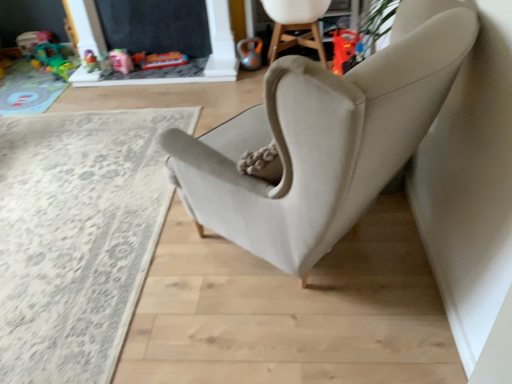
What do you see at coordinates (161, 60) in the screenshot?
I see `plastic toy car at upper center, positioned as the second toy in right-to-left order` at bounding box center [161, 60].

This screenshot has height=384, width=512. What do you see at coordinates (296, 25) in the screenshot? I see `suede beige armchair at upper center` at bounding box center [296, 25].

The image size is (512, 384). What do you see at coordinates (52, 59) in the screenshot?
I see `translucent plastic toy at upper left, which is the fourth toy from right to left` at bounding box center [52, 59].

This screenshot has width=512, height=384. I want to click on plastic toy car at upper center, positioned as the 4th toy in left-to-right order, so click(x=161, y=60).

From the image's perspective, does beige carpet at lower left appear lower than matte pink toy at upper left, positioned as the 3th toy in left-to-right order?

Yes, from the image's perspective, beige carpet at lower left is below matte pink toy at upper left, positioned as the 3th toy in left-to-right order.

Which is in front, point (39, 353) or point (115, 53)?

The point (39, 353) is in front.

Looking at this image, who is smaller, beige carpet at lower left or matte pink toy at upper left, positioned as the 3th toy in left-to-right order?

Smaller between the two is matte pink toy at upper left, positioned as the 3th toy in left-to-right order.

Who is bigger, translucent plastic toy at upper left, which is the 2th toy from left to right, or orange metallic kettlebell at upper center, which ranks as the first toy in right-to-left order?

With larger size is translucent plastic toy at upper left, which is the 2th toy from left to right.

From a real-world perspective, is translucent plastic toy at upper left, which is the 2th toy from left to right, located beneath orange metallic kettlebell at upper center, arranged as the 5th toy when viewed from the left?

Correct, in the physical world, translucent plastic toy at upper left, which is the 2th toy from left to right, is lower than orange metallic kettlebell at upper center, arranged as the 5th toy when viewed from the left.

From a real-world perspective, count 3rd toys downward from the orange metallic kettlebell at upper center, which ranks as the first toy in right-to-left order, and point to it. Please provide its 2D coordinates.

[(52, 59)]

Is translucent plastic toy at upper left, which is the fourth toy from right to left, wider than orange metallic kettlebell at upper center, arranged as the 5th toy when viewed from the left?

Yes.

Based on the photo, who is shorter, suede beige armchair at upper center or translucent plastic toy at upper left, which is the 2th toy from left to right?

With less height is translucent plastic toy at upper left, which is the 2th toy from left to right.

Considering the sizes of objects suede beige armchair at upper center and translucent plastic toy at upper left, which is the fourth toy from right to left, in the image provided, who is wider, suede beige armchair at upper center or translucent plastic toy at upper left, which is the fourth toy from right to left,?

With larger width is suede beige armchair at upper center.

Considering the relative sizes of suede beige armchair at upper center and translucent plastic toy at upper left, which is the 2th toy from left to right, in the image provided, is suede beige armchair at upper center bigger than translucent plastic toy at upper left, which is the 2th toy from left to right,?

Yes, suede beige armchair at upper center is bigger than translucent plastic toy at upper left, which is the 2th toy from left to right.

Is suede beige armchair at upper center facing towards translucent plastic toy at upper left, which is the fourth toy from right to left?

No.

Choose the correct answer: Is beige carpet at lower left inside suede beige armchair at upper center or outside it?

beige carpet at lower left cannot be found inside suede beige armchair at upper center.

From the image's perspective, would you say beige carpet at lower left is shown under suede beige armchair at upper center?

Yes, from the image's perspective, beige carpet at lower left is below suede beige armchair at upper center.

Are beige carpet at lower left and suede beige armchair at upper center located far from each other?

Yes, beige carpet at lower left and suede beige armchair at upper center are located far from each other.

The width and height of the screenshot is (512, 384). I want to click on toy that is the 4th object located above the beige carpet at lower left (from the image's perspective), so click(x=52, y=59).

Is beige carpet at lower left turned away from translucent plastic toy at upper left, which is the 2th toy from left to right?

beige carpet at lower left is not turned away from translucent plastic toy at upper left, which is the 2th toy from left to right.

From the image's perspective, is beige carpet at lower left positioned above or below translucent plastic toy at upper left, which is the 2th toy from left to right?

beige carpet at lower left is situated lower than translucent plastic toy at upper left, which is the 2th toy from left to right, in the image.

Considering their positions, is black chalkboard at upper center located in front of or behind orange metallic kettlebell at upper center, which ranks as the first toy in right-to-left order?

Visually, black chalkboard at upper center is located in front of orange metallic kettlebell at upper center, which ranks as the first toy in right-to-left order.

What's the angular difference between black chalkboard at upper center and orange metallic kettlebell at upper center, arranged as the 5th toy when viewed from the left,'s facing directions?

10.8 degrees.

Considering the relative sizes of black chalkboard at upper center and orange metallic kettlebell at upper center, arranged as the 5th toy when viewed from the left, in the image provided, is black chalkboard at upper center wider than orange metallic kettlebell at upper center, arranged as the 5th toy when viewed from the left,?

In fact, black chalkboard at upper center might be narrower than orange metallic kettlebell at upper center, arranged as the 5th toy when viewed from the left.

Based on their positions, is black chalkboard at upper center located to the left or right of orange metallic kettlebell at upper center, which ranks as the first toy in right-to-left order?

Clearly, black chalkboard at upper center is on the left of orange metallic kettlebell at upper center, which ranks as the first toy in right-to-left order, in the image.

Is suede beige armchair at upper center oriented away from matte pink toy at upper left, positioned as the 3th toy in left-to-right order?

No, suede beige armchair at upper center's orientation is not away from matte pink toy at upper left, positioned as the 3th toy in left-to-right order.

Is suede beige armchair at upper center shorter than matte pink toy at upper left, positioned as the 3th toy in left-to-right order?

In fact, suede beige armchair at upper center may be taller than matte pink toy at upper left, positioned as the 3th toy in left-to-right order.

From the image's perspective, is suede beige armchair at upper center under matte pink toy at upper left, positioned as the 3th toy in left-to-right order?

Answer: Incorrect, from the image's perspective, suede beige armchair at upper center is higher than matte pink toy at upper left, positioned as the 3th toy in left-to-right order.

Is suede beige armchair at upper center positioned far away from matte pink toy at upper left, arranged as the third toy when viewed from the right?

Yes, suede beige armchair at upper center and matte pink toy at upper left, arranged as the third toy when viewed from the right, are quite far apart.

Image resolution: width=512 pixels, height=384 pixels. In order to click on plain in front of the matte pink toy at upper left, arranged as the third toy when viewed from the right in this screenshot , I will do `click(77, 236)`.

What are the coordinates of `the 1st toy positioned below the translucent plastic toy at upper left, which is the 2th toy from left to right (from the image's perspective)` in the screenshot? It's located at (250, 53).

Estimate the real-world distances between objects in this image. Which object is closer to beige carpet at lower left, matte pink toy at upper left, positioned as the 3th toy in left-to-right order, or translucent plastic toy at upper left, which is the 2th toy from left to right?

Based on the image, matte pink toy at upper left, positioned as the 3th toy in left-to-right order, appears to be nearer to beige carpet at lower left.

Which object lies further to the anchor point plastic toy car at upper center, positioned as the 4th toy in left-to-right order, plastic pink toy at upper left, the first toy viewed from the left, or orange metallic kettlebell at upper center, which ranks as the first toy in right-to-left order?

plastic pink toy at upper left, the first toy viewed from the left.

Looking at the image, which one is located closer to translucent plastic toy at upper left, which is the fourth toy from right to left, beige carpet at lower left or plastic toy car at upper center, positioned as the 4th toy in left-to-right order?

plastic toy car at upper center, positioned as the 4th toy in left-to-right order, is positioned closer to the anchor translucent plastic toy at upper left, which is the fourth toy from right to left.

Consider the image. From the image, which object appears to be farther from plastic pink toy at upper left, placed as the 5th toy when sorted from right to left, beige carpet at lower left or plastic toy car at upper center, positioned as the second toy in right-to-left order?

Among the two, beige carpet at lower left is located further to plastic pink toy at upper left, placed as the 5th toy when sorted from right to left.

Estimate the real-world distances between objects in this image. Which object is further from translucent plastic toy at upper left, which is the fourth toy from right to left, plastic pink toy at upper left, placed as the 5th toy when sorted from right to left, or beige carpet at lower left?

beige carpet at lower left.

Which object lies further to the anchor point black chalkboard at upper center, plastic toy car at upper center, positioned as the second toy in right-to-left order, or suede beige armchair at upper center?

suede beige armchair at upper center lies further to black chalkboard at upper center than the other object.

When comparing their distances from plastic toy car at upper center, positioned as the 4th toy in left-to-right order, does suede beige armchair at upper center or translucent plastic toy at upper left, which is the fourth toy from right to left, seem further?

suede beige armchair at upper center is further to plastic toy car at upper center, positioned as the 4th toy in left-to-right order.

Considering their positions, is translucent plastic toy at upper left, which is the fourth toy from right to left, positioned further to beige carpet at lower left than matte pink toy at upper left, positioned as the 3th toy in left-to-right order?

translucent plastic toy at upper left, which is the fourth toy from right to left, lies further to beige carpet at lower left than the other object.

Find the location of a particular element. toy between plastic pink toy at upper left, placed as the 5th toy when sorted from right to left, and matte pink toy at upper left, arranged as the third toy when viewed from the right, in the horizontal direction is located at coordinates (52, 59).

Image resolution: width=512 pixels, height=384 pixels. I want to click on fireplace between matte pink toy at upper left, positioned as the 3th toy in left-to-right order, and suede beige armchair at upper center, in the horizontal direction, so click(207, 62).

Where is `toy between plastic toy car at upper center, positioned as the 4th toy in left-to-right order, and suede beige armchair at upper center from left to right`? This screenshot has height=384, width=512. toy between plastic toy car at upper center, positioned as the 4th toy in left-to-right order, and suede beige armchair at upper center from left to right is located at coordinates (250, 53).

Find the location of `toy located between translucent plastic toy at upper left, which is the fourth toy from right to left, and plastic toy car at upper center, positioned as the 4th toy in left-to-right order, in the left-right direction`. toy located between translucent plastic toy at upper left, which is the fourth toy from right to left, and plastic toy car at upper center, positioned as the 4th toy in left-to-right order, in the left-right direction is located at coordinates (121, 61).